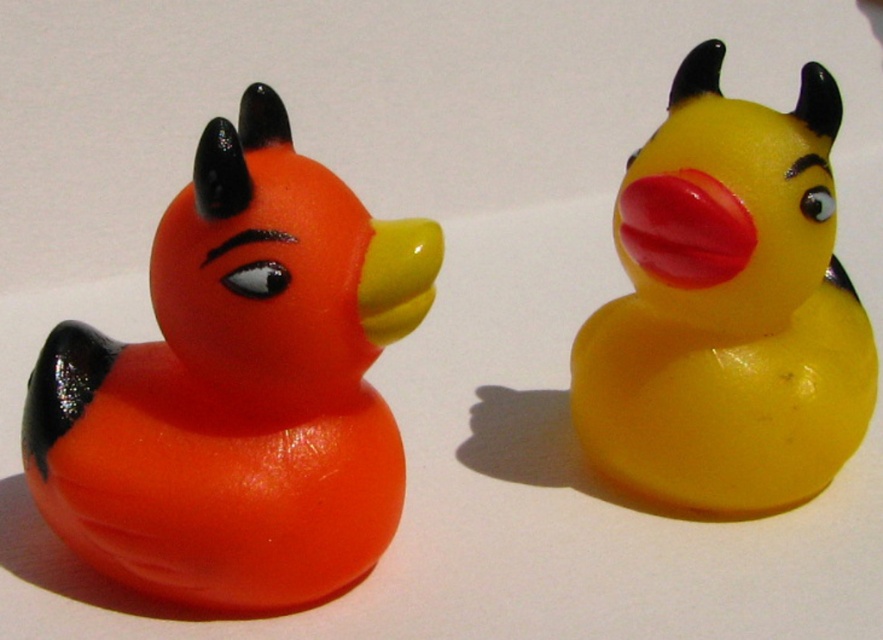
Question: Among these objects, which one is farthest from the camera?

Choices:
 (A) yellow rubber duck at center
 (B) rubber at right

Answer: (B)

Question: Among these points, which one is farthest from the camera?

Choices:
 (A) (693, 177)
 (B) (223, 605)
 (C) (776, 330)

Answer: (C)

Question: Is yellow rubber duck at center positioned in front of rubber at right?

Choices:
 (A) no
 (B) yes

Answer: (B)

Question: Which of the following is the farthest from the observer?

Choices:
 (A) (655, 204)
 (B) (869, 349)
 (C) (330, 278)

Answer: (B)

Question: Does matte orange rubber duck at left lie behind yellow rubber duck at center?

Choices:
 (A) no
 (B) yes

Answer: (A)

Question: Does matte orange rubber duck at left have a lesser width compared to yellow rubber duck at center?

Choices:
 (A) yes
 (B) no

Answer: (B)